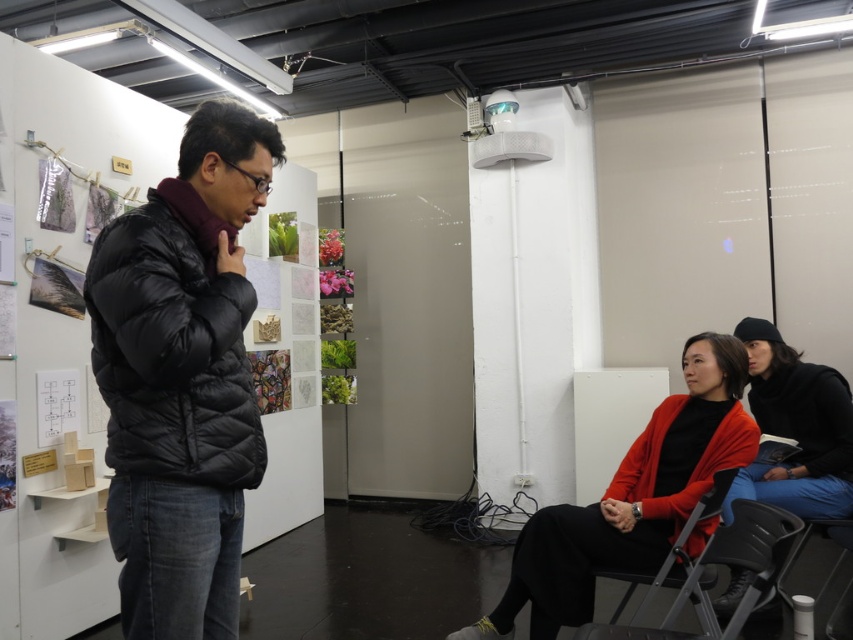
You are a photographer setting up a camera to capture a group photo of the black puffer jacket at center and the matte black sweater at lower right. The camera has a maximum focus range of 2 meters. Will you be able to capture both subjects clearly in the same frame without moving the camera?

The black puffer jacket at center and matte black sweater at lower right are 2.25 meters apart. Since the camera can only focus within 2 meters, the distance between them exceeds the maximum focus range. Therefore, you won me be able to capture both subjects clearly in the same frame without moving the camera.

Based on the coordinates provided, which object is located at point (183,378) in the image?

The point (183,378) corresponds to the black puffer jacket at center.

You are an interior designer assessing the layout of this gallery space. You notice the black puffer jacket at center and the matte black sweater at lower right. Which of these items takes up more horizontal space in the image?

The matte black sweater at lower right takes up more horizontal space than the black puffer jacket at center because the black puffer jacket at center has a lesser width compared to matte black sweater at lower right.